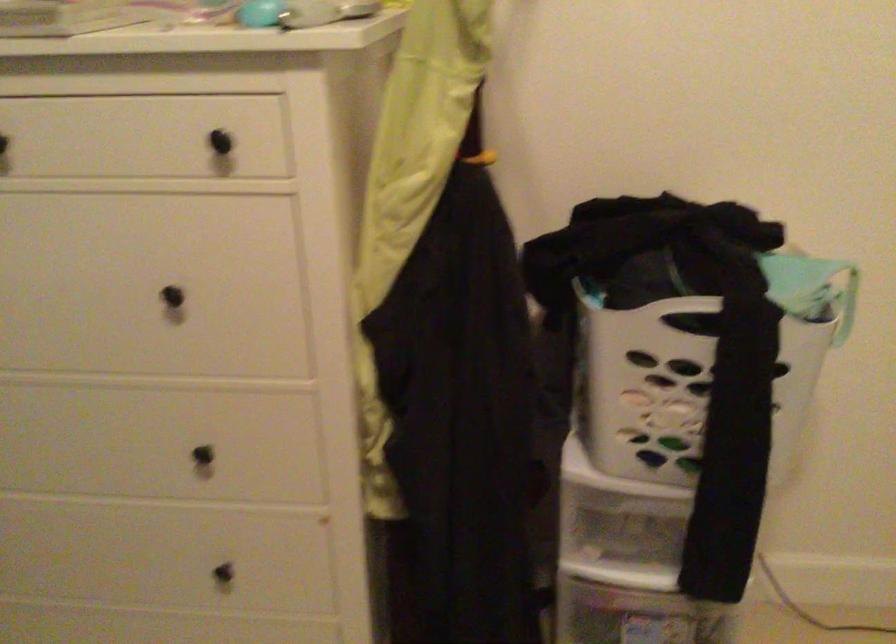
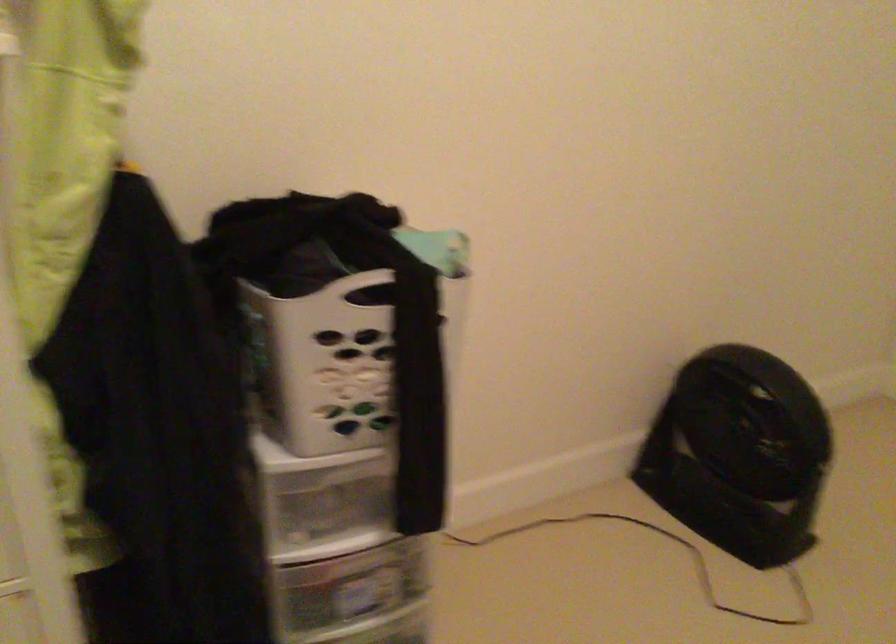
Question: The camera is either moving clockwise (left) or counter-clockwise (right) around the object. The first image is from the beginning of the video and the second image is from the end. Is the camera moving left or right when shooting the video?

Choices:
 (A) Left
 (B) Right

Answer: (A)